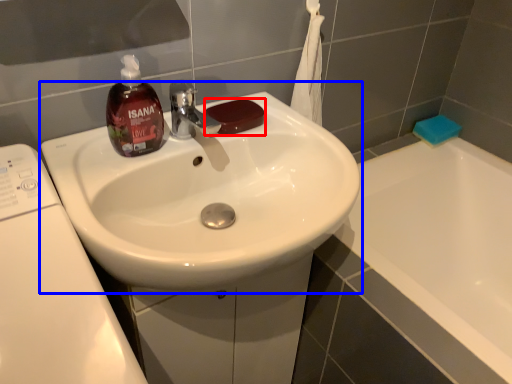
Question: Among these objects, which one is nearest to the camera, soap (highlighted by a red box) or sink (highlighted by a blue box)?

Choices:
 (A) soap
 (B) sink

Answer: (B)